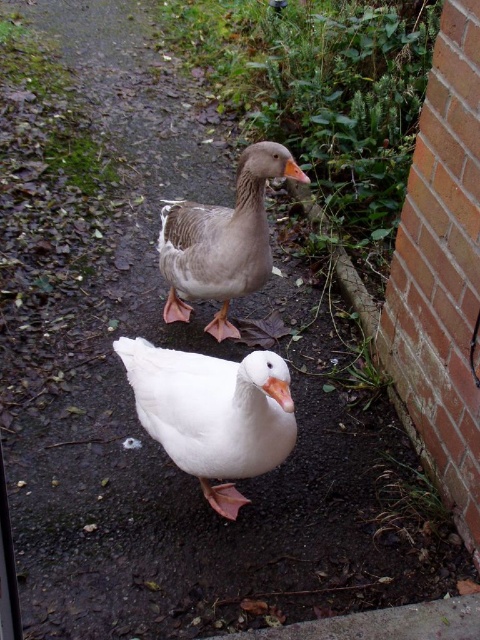
You are standing near the pathway and want to observe the white matte duck at center without disturbing it. What is the minimum distance you should maintain to ensure you are not too close?

The minimum distance you should maintain is 1.11 meters to ensure you are not too close to the white matte duck at center.